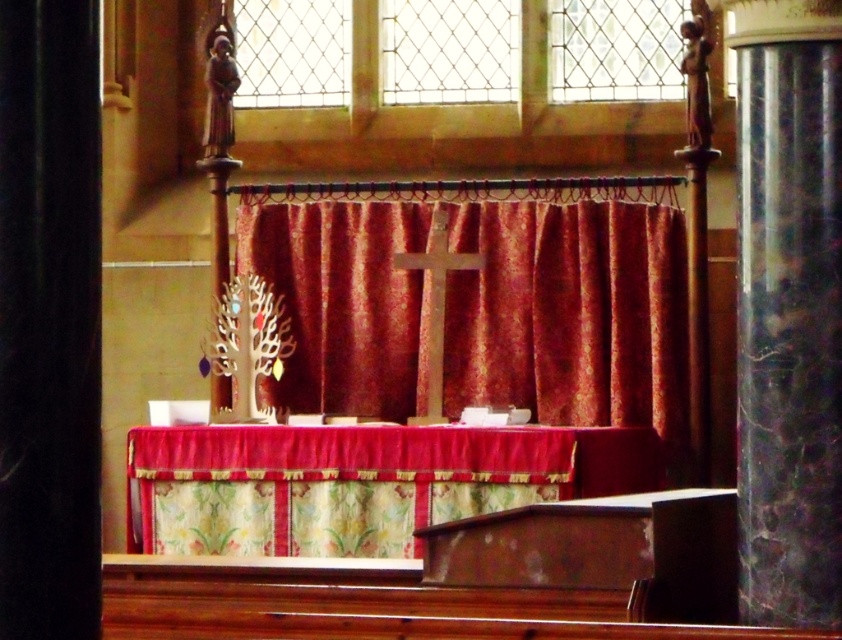
Between clear glass lattice at upper center and clear glass window at upper center, which one is positioned lower?

clear glass window at upper center

Is the position of clear glass lattice at upper center less distant than that of clear glass window at upper center?

Yes, clear glass lattice at upper center is in front of clear glass window at upper center.

Does point (499, 99) come in front of point (321, 64)?

Yes, point (499, 99) is in front of point (321, 64).

This screenshot has height=640, width=842. What are the coordinates of `clear glass lattice at upper center` in the screenshot? It's located at (449, 51).

I want to click on marble column at right, so click(787, 308).

Does marble column at right have a lesser width compared to clear glass window at upper center?

No.

The image size is (842, 640). I want to click on marble column at right, so click(x=787, y=308).

Is velvet red curtain at center below marble column at right?

Incorrect, velvet red curtain at center is not positioned below marble column at right.

Image resolution: width=842 pixels, height=640 pixels. Find the location of `velvet red curtain at center`. velvet red curtain at center is located at coordinates (569, 314).

Is point (616, 346) farther from viewer compared to point (803, 147)?

Yes, it is.

Find the location of `velvet red curtain at center`. velvet red curtain at center is located at coordinates (569, 314).